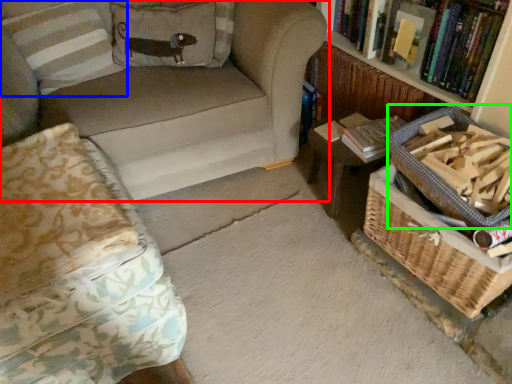
Question: Considering the real-world distances, which object is farthest from studio couch (highlighted by a red box)? pillow (highlighted by a blue box) or basket (highlighted by a green box)?

Choices:
 (A) pillow
 (B) basket

Answer: (B)